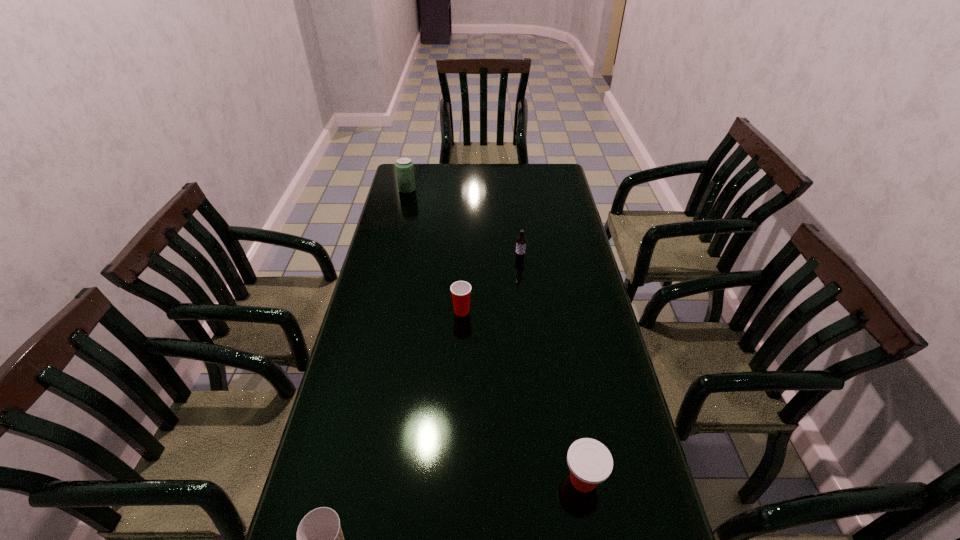
Find the location of a particular element. free spot between the rightmost object and the soda is located at coordinates (495, 335).

You are a GUI agent. You are given a task and a screenshot of the screen. Output one action in this format:
    pyautogui.click(x=<x>, y=<y>)
    Task: Click on the vacant space that is in between the rightmost Dixie cup and the third nearest object
    
    Given the screenshot: What is the action you would take?
    (x=522, y=395)

This screenshot has width=960, height=540. Identify the location of empty space between the farthest Dixie cup and the second farthest object. [491, 285].

Point out which object is positioned as the fourth nearest to the fourth object from left to right. Please provide its 2D coordinates. Your answer should be formatted as a tuple, i.e. [(x, y)], where the tuple contains the x and y coordinates of a point satisfying the conditions above.

[(320, 539)]

Find the location of a particular element. This screenshot has width=960, height=540. the closest object to the nearest object is located at coordinates (590, 462).

The width and height of the screenshot is (960, 540). Find the location of `the second closest Dixie cup to the third object from left to right`. the second closest Dixie cup to the third object from left to right is located at coordinates coord(320,539).

The image size is (960, 540). Identify the location of the third closest Dixie cup relative to the farthest object. (320, 539).

Find the location of a particular element. The image size is (960, 540). free space that satisfies the following two spatial constraints: 1. on the front side of the second nearest Dixie cup; 2. on the right side of the third object from right to left is located at coordinates (455, 480).